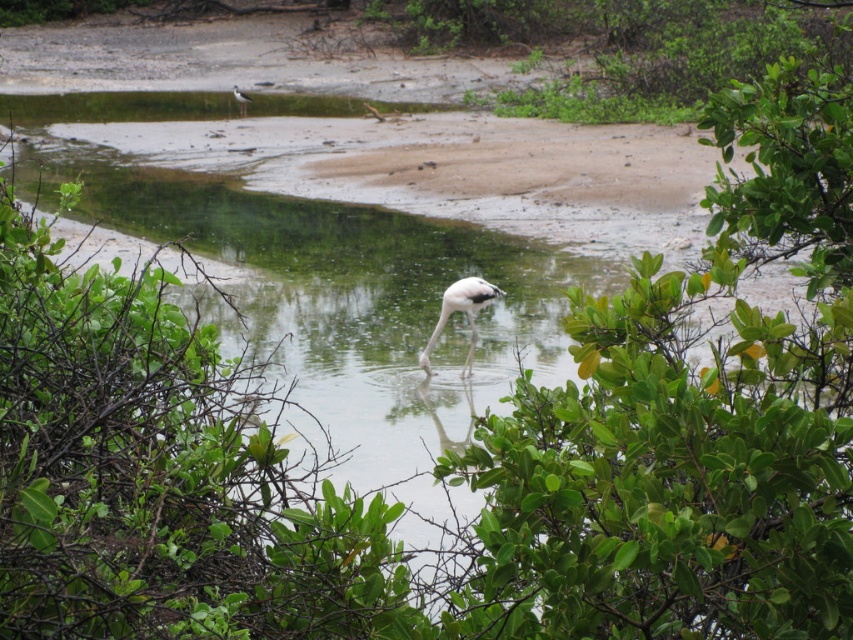
You are a birdwatcher observing the wetland scene. You notice a point at coordinates (462, 310). What object is located at that point?

The white matte flamingo at center is located at point (462, 310).

You are a birdwatcher observing the scene. You see a white matte flamingo at center and a white matte bird at upper left. Which of these two birds is positioned to the right side of the other?

The white matte flamingo at center is positioned to the right of the white matte bird at upper left.